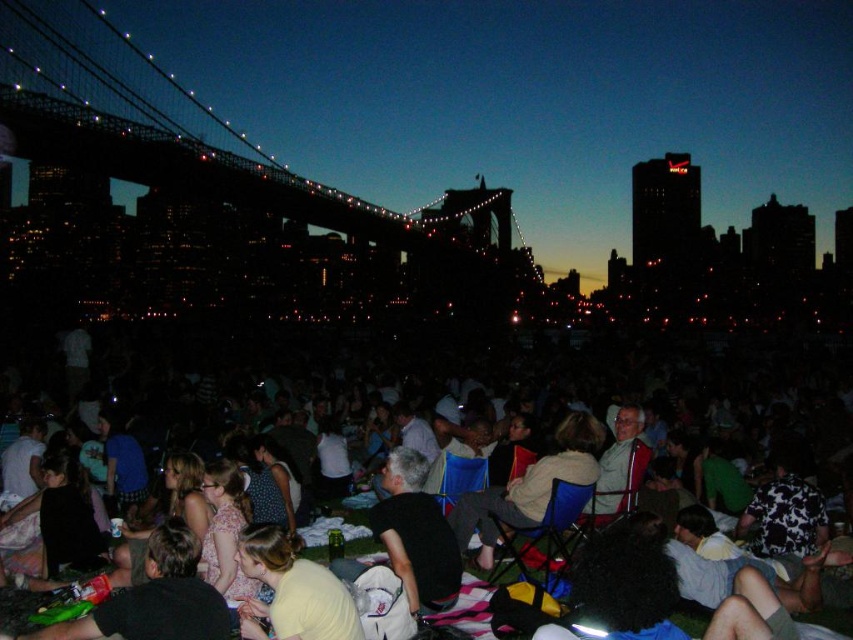
Question: Is silhouette steel bridge at upper left below matte black chairs at center?

Choices:
 (A) yes
 (B) no

Answer: (B)

Question: Is matte black chairs at center below light brown fabric jacket at center?

Choices:
 (A) yes
 (B) no

Answer: (B)

Question: Based on their relative distances, which object is nearer to the matte black chairs at center?

Choices:
 (A) silhouette steel bridge at upper left
 (B) light brown fabric jacket at center
 (C) yellow cotton shirt at center

Answer: (B)

Question: Which point is closer to the camera taking this photo?

Choices:
 (A) (515, 360)
 (B) (561, 424)
 (C) (245, 621)

Answer: (C)

Question: Where is matte black chairs at center located in relation to yellow cotton shirt at center in the image?

Choices:
 (A) left
 (B) right

Answer: (B)

Question: Estimate the real-world distances between objects in this image. Which object is farther from the silhouette steel bridge at upper left?

Choices:
 (A) light brown fabric jacket at center
 (B) yellow cotton shirt at center

Answer: (A)